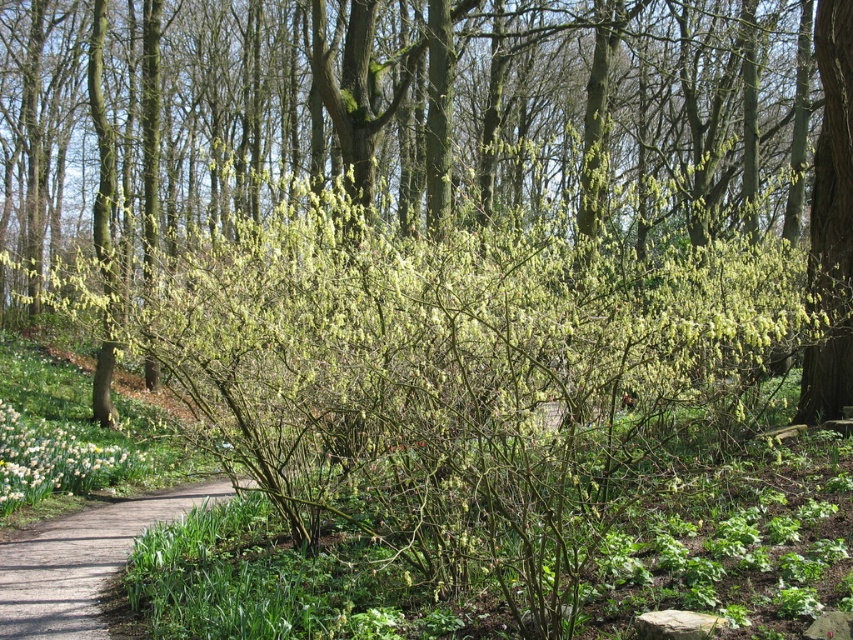
Question: Which point is closer to the camera?

Choices:
 (A) green leafy bush at right
 (B) white glossy flower at lower left
 (C) brown gravel path at lower left

Answer: (A)

Question: Is brown gravel path at lower left to the right of white glossy flower at lower left from the viewer's perspective?

Choices:
 (A) yes
 (B) no

Answer: (A)

Question: Does brown gravel path at lower left appear on the left side of green leafy bush at right?

Choices:
 (A) no
 (B) yes

Answer: (B)

Question: Which object is closer to the camera taking this photo?

Choices:
 (A) brown gravel path at lower left
 (B) green leafy bush at center
 (C) green leafy bush at right

Answer: (B)

Question: Which point is closer to the camera?

Choices:
 (A) (138, 497)
 (B) (838, 3)

Answer: (B)

Question: Does green leafy bush at center have a lesser width compared to white glossy flower at lower left?

Choices:
 (A) no
 (B) yes

Answer: (A)